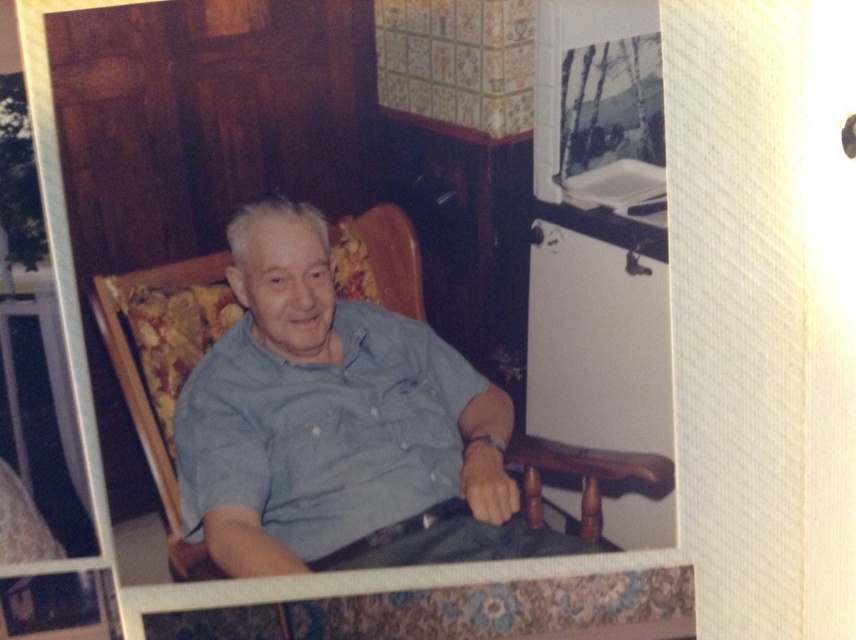
Question: Can you confirm if blue cotton shirt at center is positioned above dark green fabric at lower center?

Choices:
 (A) yes
 (B) no

Answer: (A)

Question: Which of the following is the closest to the observer?

Choices:
 (A) (474, 372)
 (B) (506, 531)

Answer: (B)

Question: Can you confirm if blue cotton shirt at center is thinner than dark green fabric at lower center?

Choices:
 (A) no
 (B) yes

Answer: (A)

Question: Does blue cotton shirt at center have a larger size compared to dark green fabric at lower center?

Choices:
 (A) yes
 (B) no

Answer: (A)